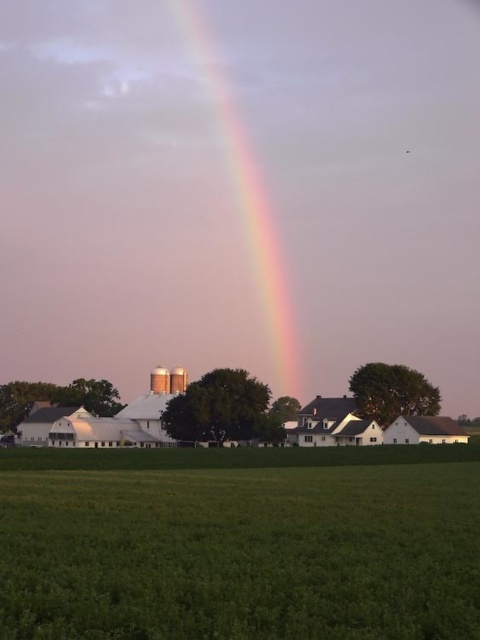
Question: Does green grass at lower center appear on the right side of rainbow at center?

Choices:
 (A) yes
 (B) no

Answer: (A)

Question: From the image, what is the correct spatial relationship of green grass at lower center in relation to rainbow at center?

Choices:
 (A) above
 (B) below

Answer: (B)

Question: Among these points, which one is nearest to the camera?

Choices:
 (A) (259, 177)
 (B) (223, 552)

Answer: (B)

Question: Which point appears farthest from the camera in this image?

Choices:
 (A) (454, 472)
 (B) (206, 42)

Answer: (B)

Question: Does green grass at lower center have a greater width compared to rainbow at center?

Choices:
 (A) yes
 (B) no

Answer: (B)